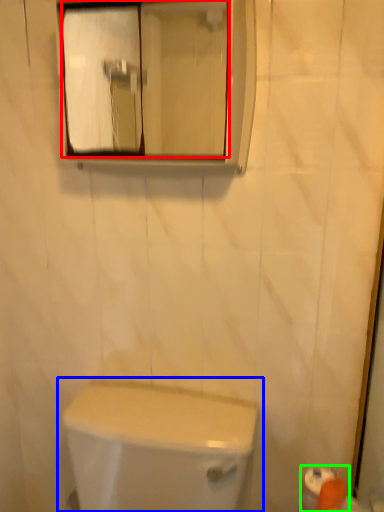
Question: Based on their relative distances, which object is farther from mirror (highlighted by a red box)? Choose from toilet (highlighted by a blue box) and toilet paper (highlighted by a green box).

Choices:
 (A) toilet
 (B) toilet paper

Answer: (B)